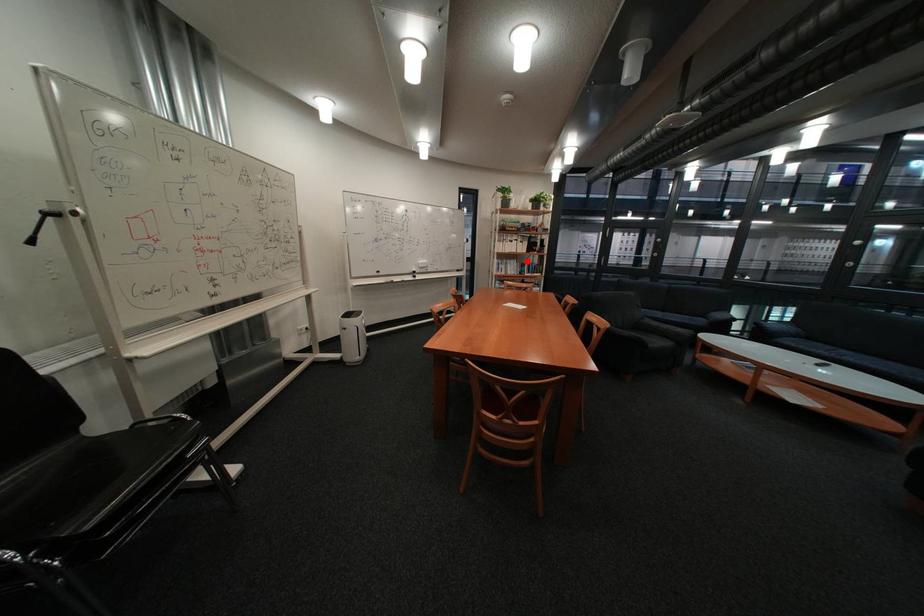
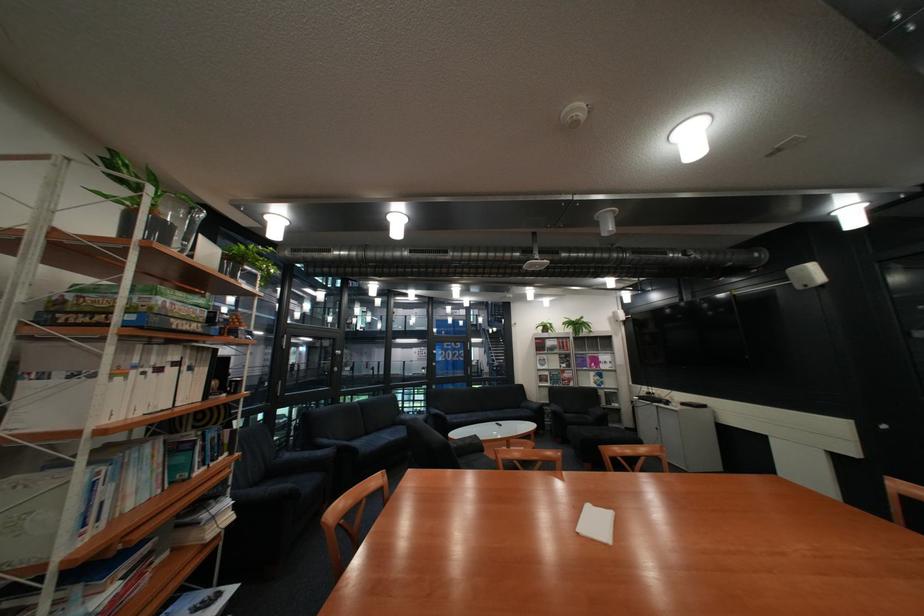
In the second image, find the point that corresponds to the highlighted location in the first image.

(163, 448)